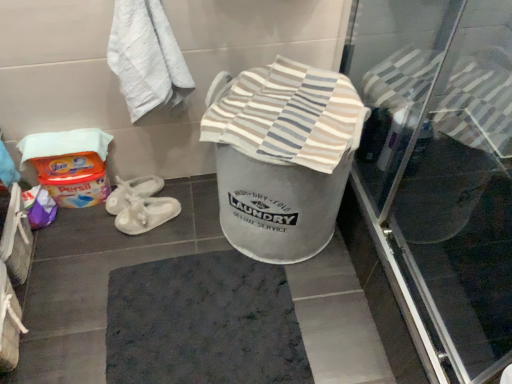
Where is `vacant space in white textured towel at upper left (from a real-world perspective)`? Image resolution: width=512 pixels, height=384 pixels. vacant space in white textured towel at upper left (from a real-world perspective) is located at coordinates (187, 191).